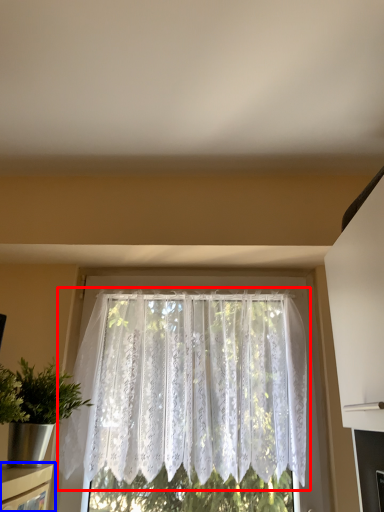
Question: Which point is further to the camera, window (highlighted by a red box) or shelf (highlighted by a blue box)?

Choices:
 (A) window
 (B) shelf

Answer: (A)